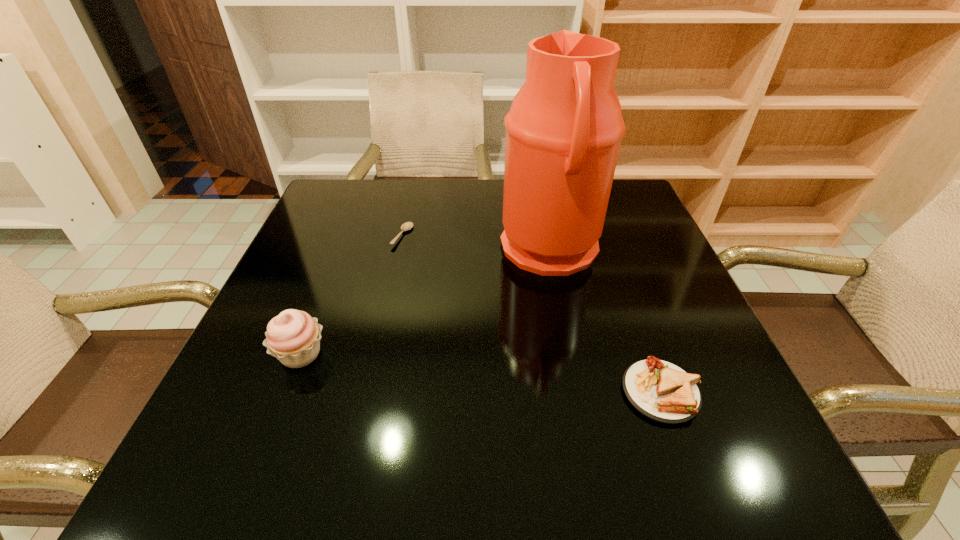
The height and width of the screenshot is (540, 960). I want to click on free space at the left edge of the desktop, so click(x=301, y=412).

I want to click on vacant space at the right edge, so click(689, 366).

Where is `vacant region at the far left corner`? This screenshot has width=960, height=540. vacant region at the far left corner is located at coordinates (358, 201).

Where is `free location at the near left corner`? Image resolution: width=960 pixels, height=540 pixels. free location at the near left corner is located at coordinates (251, 491).

What are the coordinates of `vacant space at the near right corner` in the screenshot? It's located at (696, 491).

This screenshot has height=540, width=960. I want to click on empty space between the tallest object and the third tallest object, so click(606, 321).

Where is `free space between the sandwich and the tallest object`? free space between the sandwich and the tallest object is located at coordinates (606, 321).

The image size is (960, 540). Identify the location of free area in between the second shortest object and the cupcake. (481, 373).

Where is `free space between the tallest object and the shortest object`? Image resolution: width=960 pixels, height=540 pixels. free space between the tallest object and the shortest object is located at coordinates (476, 243).

Find the location of a particular element. This screenshot has width=960, height=540. free space between the tallest object and the leftmost object is located at coordinates (425, 302).